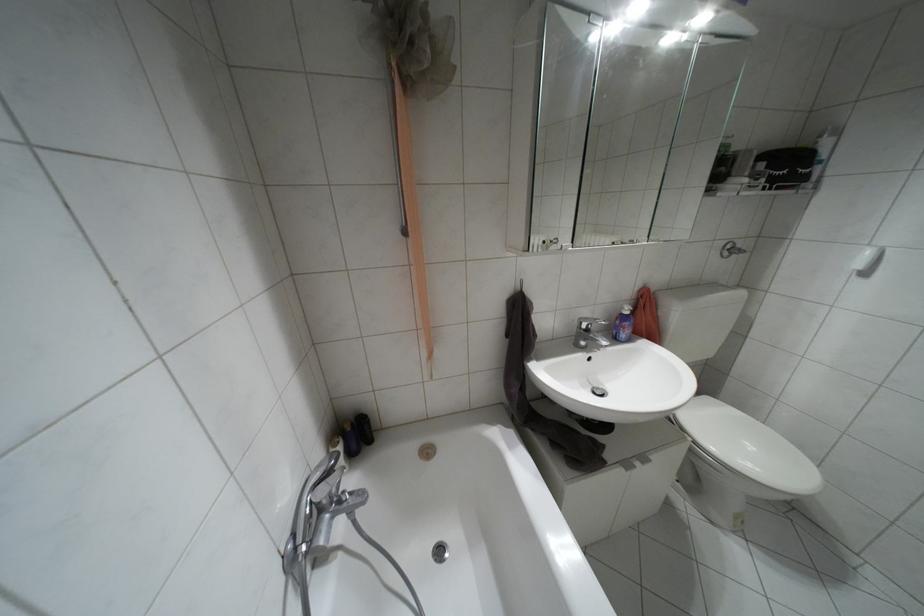
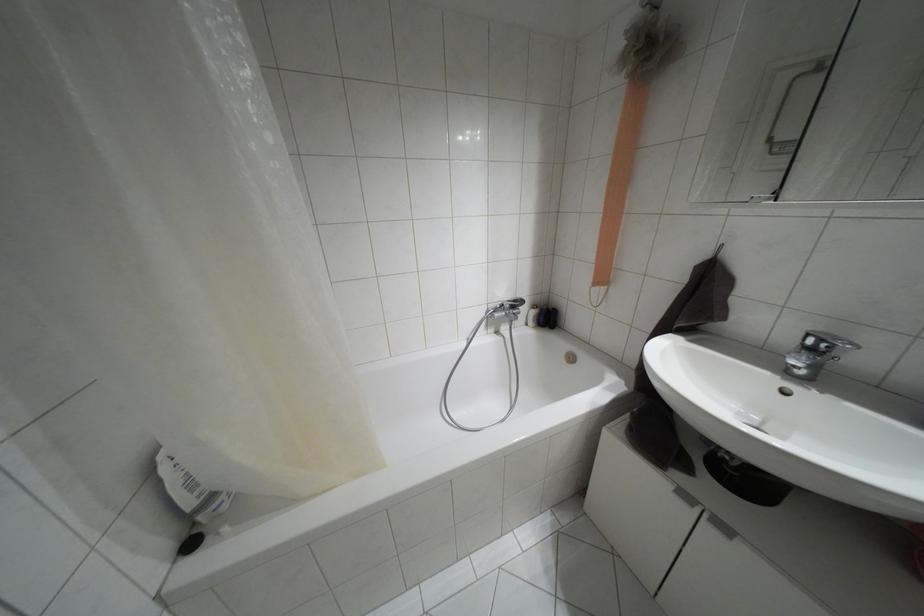
In the second image, find the point that corresponds to point 626,464 in the first image.

(685, 496)